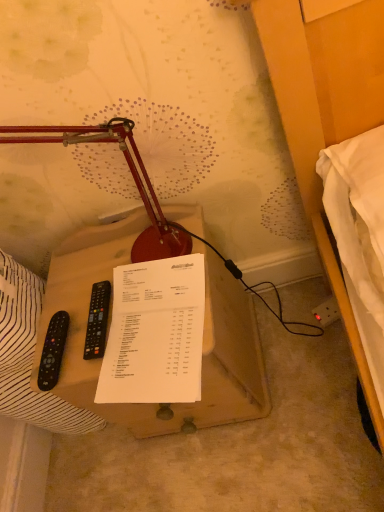
Locate an element on the screen. The height and width of the screenshot is (512, 384). white paper at left is located at coordinates (29, 356).

What is the approximate width of black plastic remote at left, the second remote control in the right-to-left sequence?

18.20 centimeters.

Locate an element on the screen. The height and width of the screenshot is (512, 384). white paper at left is located at coordinates (29, 356).

Considering the positions of objects matte red lamp at center and black plastic remote at left, which is the 1th remote control in left-to-right order, in the image provided, who is in front, matte red lamp at center or black plastic remote at left, which is the 1th remote control in left-to-right order,?

matte red lamp at center is in front.

From the image's perspective, between matte red lamp at center and black plastic remote at left, the second remote control in the right-to-left sequence, who is located below?

From the image's view, black plastic remote at left, the second remote control in the right-to-left sequence, is below.

From a real-world perspective, is matte red lamp at center on top of black plastic remote at left, which is the 1th remote control in left-to-right order?

Yes, from a real-world perspective, matte red lamp at center is over black plastic remote at left, which is the 1th remote control in left-to-right order

Does black plastic remote control at left, which is the 1th remote control in right-to-left order, appear on the left side of matte red lamp at center?

No, black plastic remote control at left, which is the 1th remote control in right-to-left order, is not to the left of matte red lamp at center.

Is black plastic remote control at left, which is the 1th remote control in right-to-left order, closer to the viewer compared to matte red lamp at center?

That is False.

Which is in front, point (95, 317) or point (144, 194)?

The point (144, 194) is in front.

Which object is wider, black plastic remote control at left, acting as the 2th remote control starting from the left, or matte red lamp at center?

With larger width is black plastic remote control at left, acting as the 2th remote control starting from the left.

From the picture: Does wooden table at center turn towards white paper at left?

No, wooden table at center is not turned towards white paper at left.

From the image's perspective, which one is positioned lower, wooden table at center or white paper at left?

white paper at left appears lower in the image.

Can you tell me how much wooden table at center and white paper at left differ in facing direction?

1.62 degrees separate the facing orientations of wooden table at center and white paper at left.

From the image's perspective, is white paper at center under wooden table at center?

No, from the image's perspective, white paper at center is not below wooden table at center.

The image size is (384, 512). Find the location of `document on the left of wooden table at center`. document on the left of wooden table at center is located at coordinates (155, 333).

Is white paper at center not within wooden table at center?

No, white paper at center is not entirely external to wooden table at center.

Can black plastic remote control at left, which is the 1th remote control in right-to-left order, be found inside wooden table at center?

Absolutely, black plastic remote control at left, which is the 1th remote control in right-to-left order, is inside wooden table at center.

Is wooden table at center taller than black plastic remote control at left, which is the 1th remote control in right-to-left order?

Yes.

Could you tell me if wooden table at center is turned towards black plastic remote control at left, acting as the 2th remote control starting from the left?

No, wooden table at center is not oriented towards black plastic remote control at left, acting as the 2th remote control starting from the left.

From a real-world perspective, is wooden table at center beneath black plastic remote control at left, acting as the 2th remote control starting from the left?

Yes, from a real-world perspective, wooden table at center is below black plastic remote control at left, acting as the 2th remote control starting from the left.

From the image's perspective, would you say matte red lamp at center is positioned over white paper at left?

Correct, matte red lamp at center appears higher than white paper at left in the image.

Is matte red lamp at center outside of white paper at left?

Absolutely, matte red lamp at center is external to white paper at left.

Looking at this image, is matte red lamp at center placed right next to white paper at left?

They are not placed beside each other.

From a real-world perspective, is matte red lamp at center positioned above or below white paper at left?

matte red lamp at center is situated higher than white paper at left in the real world.

Does matte red lamp at center appear on the left side of white paper at center?

Yes, matte red lamp at center is to the left of white paper at center.

Do you think matte red lamp at center is within white paper at center, or outside of it?

matte red lamp at center is not enclosed by white paper at center.

Is matte red lamp at center not near white paper at center?

They are positioned close to each other.

From the image's perspective, who appears lower, matte red lamp at center or white paper at center?

white paper at center.

At what (x,y) coordinates should I click in order to perform the action: click on lamp lying on the right of black plastic remote at left, which is the 1th remote control in left-to-right order. Please return your answer as a coordinate pair (x, y). This screenshot has width=384, height=512. Looking at the image, I should click on (131, 173).

Find the location of a particular element. This screenshot has height=512, width=384. lamp that appears above the black plastic remote control at left, which is the 1th remote control in right-to-left order (from the image's perspective) is located at coordinates point(131,173).

Estimate the real-world distances between objects in this image. Which object is further from black plastic remote control at left, acting as the 2th remote control starting from the left, matte red lamp at center or black plastic remote at left, the second remote control in the right-to-left sequence?

matte red lamp at center is positioned further to the anchor black plastic remote control at left, acting as the 2th remote control starting from the left.

Looking at the image, which one is located further to black plastic remote control at left, which is the 1th remote control in right-to-left order, black plastic remote at left, the second remote control in the right-to-left sequence, or matte red lamp at center?

The object further to black plastic remote control at left, which is the 1th remote control in right-to-left order, is matte red lamp at center.

Consider the image. Estimate the real-world distances between objects in this image. Which object is closer to black plastic remote control at left, acting as the 2th remote control starting from the left, black plastic remote at left, which is the 1th remote control in left-to-right order, or white paper at left?

Based on the image, black plastic remote at left, which is the 1th remote control in left-to-right order, appears to be nearer to black plastic remote control at left, acting as the 2th remote control starting from the left.

Estimate the real-world distances between objects in this image. Which object is closer to white paper at left, wooden table at center or matte red lamp at center?

wooden table at center is closer to white paper at left.

Which object lies further to the anchor point black plastic remote at left, the second remote control in the right-to-left sequence, wooden table at center or black plastic remote control at left, which is the 1th remote control in right-to-left order?

wooden table at center.

Estimate the real-world distances between objects in this image. Which object is further from wooden table at center, white paper at left or black plastic remote control at left, which is the 1th remote control in right-to-left order?

Based on the image, black plastic remote control at left, which is the 1th remote control in right-to-left order, appears to be further to wooden table at center.

Estimate the real-world distances between objects in this image. Which object is further from black plastic remote control at left, which is the 1th remote control in right-to-left order, wooden table at center or black plastic remote at left, which is the 1th remote control in left-to-right order?

wooden table at center.

From the image, which object appears to be nearer to black plastic remote at left, the second remote control in the right-to-left sequence, white paper at center or white paper at left?

white paper at left is positioned closer to the anchor black plastic remote at left, the second remote control in the right-to-left sequence.

Identify the location of remote control between black plastic remote at left, the second remote control in the right-to-left sequence, and wooden table at center, in the horizontal direction. The width and height of the screenshot is (384, 512). (97, 321).

The width and height of the screenshot is (384, 512). In order to click on document between matte red lamp at center and wooden table at center vertically in this screenshot , I will do coord(155,333).

Identify the location of document situated between black plastic remote at left, the second remote control in the right-to-left sequence, and wooden table at center from left to right. (155, 333).

I want to click on document between white paper at left and wooden table at center from left to right, so tap(155, 333).